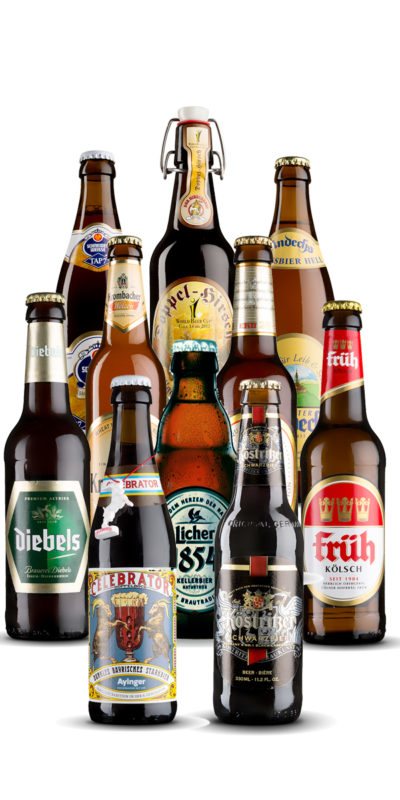
You are a GUI agent. You are given a task and a screenshot of the screen. Output one action in this format:
    pyautogui.click(x=<x>, y=<y>)
    Task: Click on the bottles
    Image resolution: width=400 pixels, height=800 pixels.
    Given the screenshot: What is the action you would take?
    pyautogui.click(x=351, y=444), pyautogui.click(x=260, y=538), pyautogui.click(x=299, y=270), pyautogui.click(x=253, y=336), pyautogui.click(x=189, y=421), pyautogui.click(x=189, y=258), pyautogui.click(x=125, y=349), pyautogui.click(x=134, y=508), pyautogui.click(x=45, y=433), pyautogui.click(x=85, y=290)